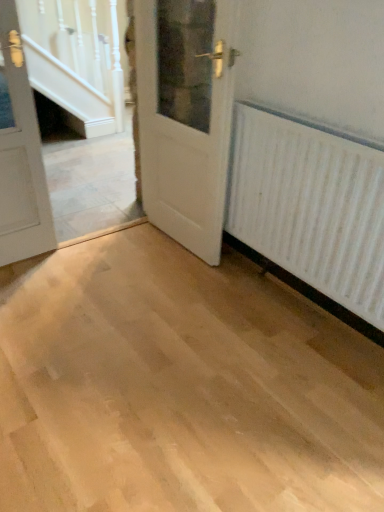
The height and width of the screenshot is (512, 384). Find the location of `vacant position to the left of white wood door at center, the 1th door positioned from the right`. vacant position to the left of white wood door at center, the 1th door positioned from the right is located at coordinates (132, 250).